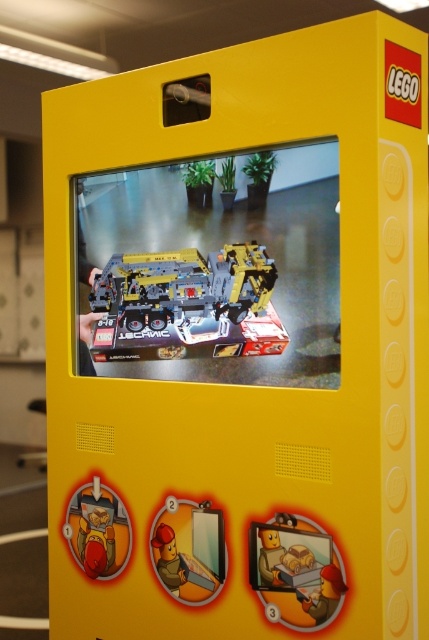
Consider the image. You are holding a smartphone that is 6 inches long. You want to take a photo of the yellow plastic lego set at center from where you are standing. Can your phone capture the entire lego set in one shot without moving the phone or zooming in? Explain your reasoning.

The yellow plastic lego set at center is 31.44 inches away from the camera. Since your smartphone is only 6 inches long, the distance between you and the lego set is much greater than the phone length. Therefore, the phone can easily capture the entire lego set in one shot without needing to move or zoom.